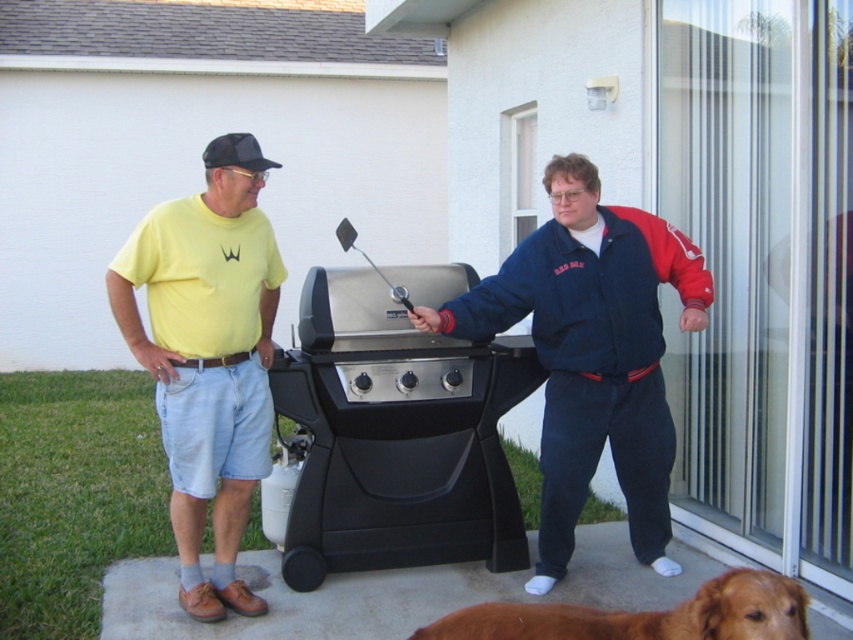
Question: Is black matte barbecue grill at center to the right of yellow cotton t-shirt at left from the viewer's perspective?

Choices:
 (A) yes
 (B) no

Answer: (A)

Question: Among these objects, which one is nearest to the camera?

Choices:
 (A) transparent glass door at right
 (B) navy blue fleece jacket at center
 (C) brown furry dog at lower right

Answer: (C)

Question: Which is farther from the yellow cotton t-shirt at left?

Choices:
 (A) brown furry dog at lower right
 (B) black matte barbecue grill at center
 (C) navy blue fleece jacket at center

Answer: (A)

Question: Does transparent glass door at right have a lesser width compared to navy blue fleece jacket at center?

Choices:
 (A) yes
 (B) no

Answer: (A)

Question: Is yellow cotton t-shirt at left bigger than brown furry dog at lower right?

Choices:
 (A) no
 (B) yes

Answer: (B)

Question: Among these points, which one is farthest from the camera?

Choices:
 (A) (563, 464)
 (B) (399, 451)
 (C) (547, 611)

Answer: (B)